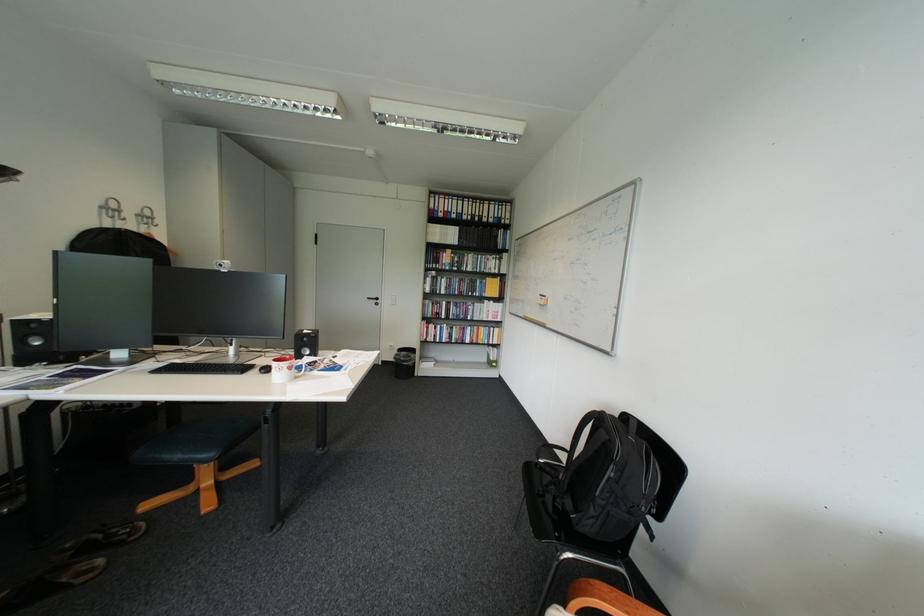
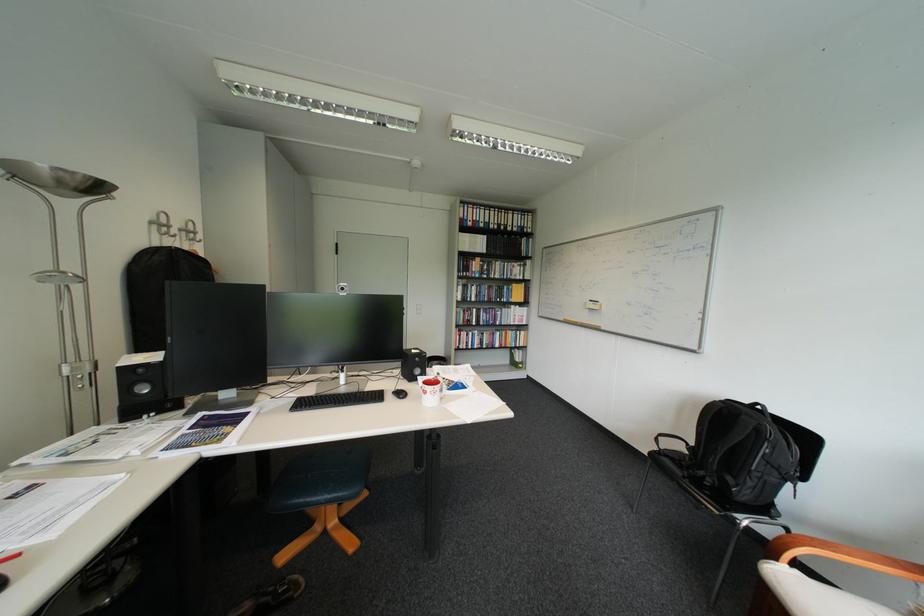
Find the pixel in the second image that matches point (124, 211) in the first image.

(173, 225)